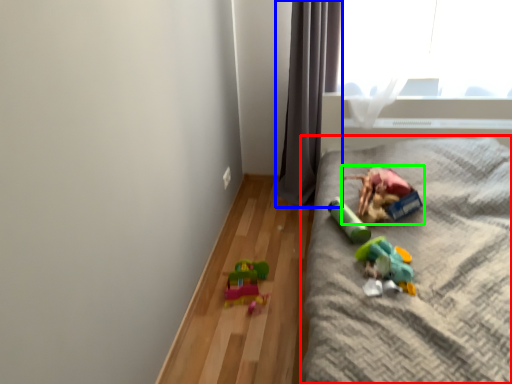
Question: Considering the real-world distances, which object is closest to furniture (highlighted by a red box)? curtain (highlighted by a blue box) or toy (highlighted by a green box).

Choices:
 (A) curtain
 (B) toy

Answer: (B)